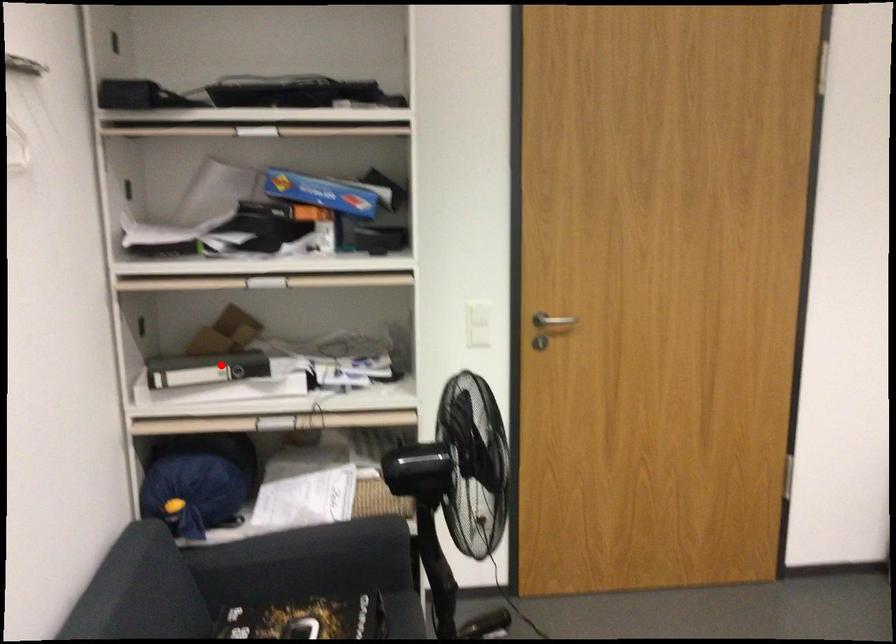
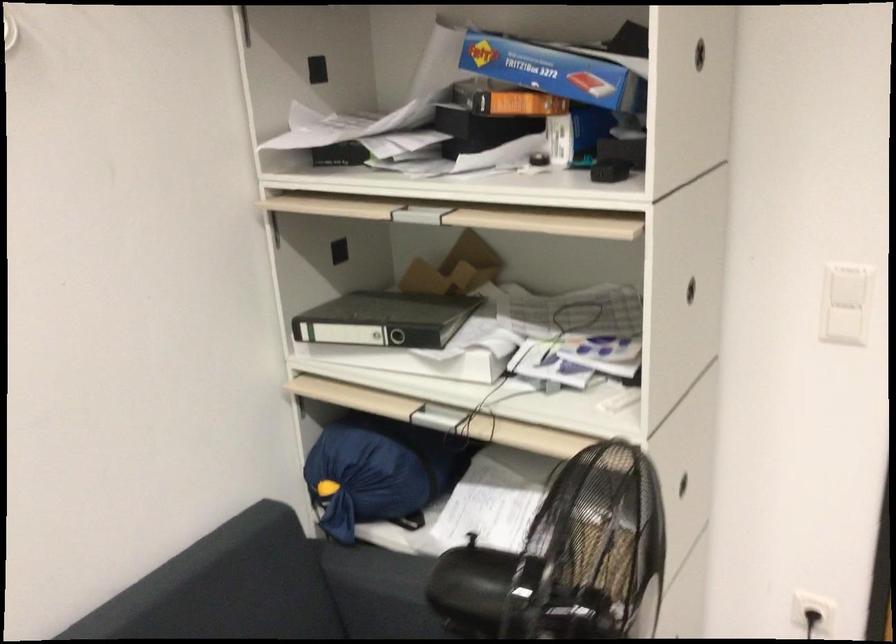
Question: A red point is marked in image1. In image2, is the corresponding 3D point closer to the camera or farther? Reply with the corresponding letter.

Choices:
 (A) The corresponding 3D point is closer.
 (B) The corresponding 3D point is farther.

Answer: (A)